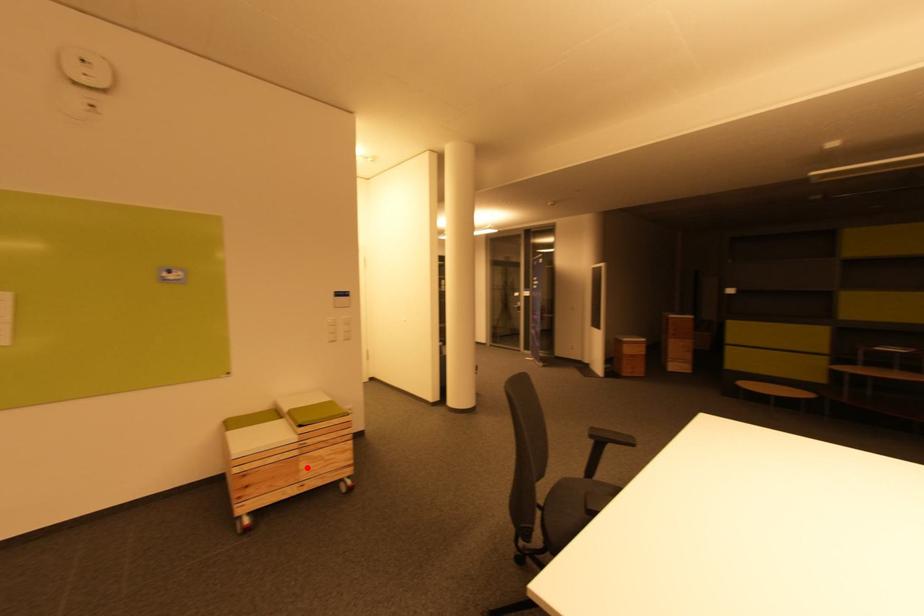
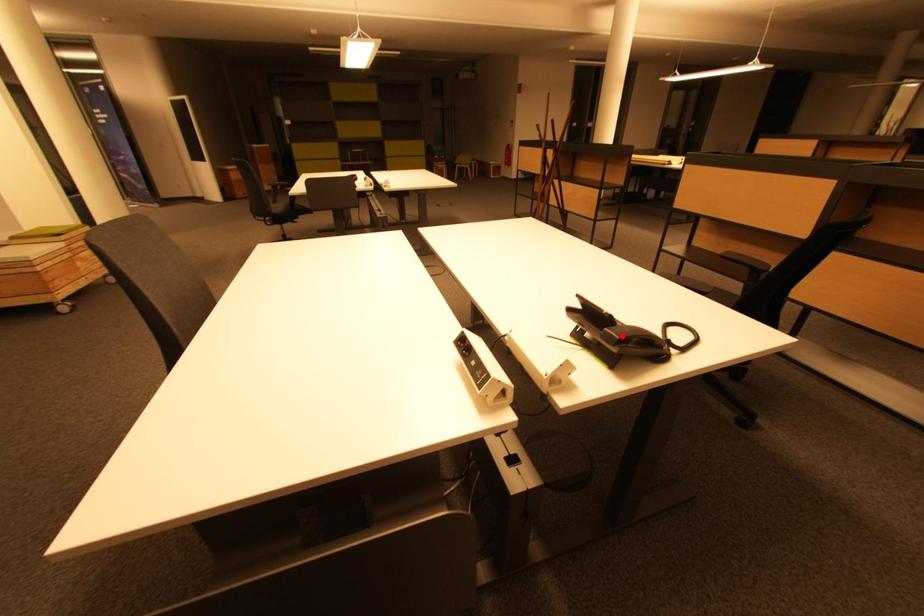
I am providing you with two images of the same scene from different viewpoints. A red point is marked on the first image and another point is marked on the second image. Does the point marked in image1 correspond to the same location as the one in image2?

No